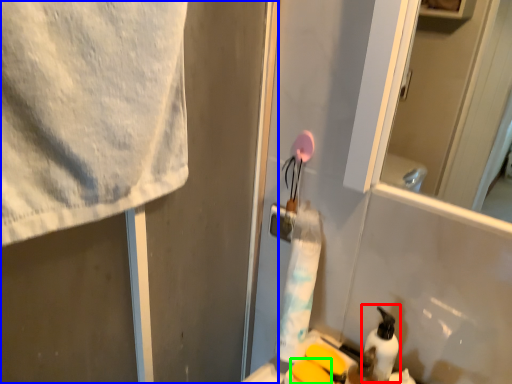
Question: Which object is the farthest from cleaning product (highlighted by a red box)? Choose among these: screen door (highlighted by a blue box) or soap (highlighted by a green box).

Choices:
 (A) screen door
 (B) soap

Answer: (A)